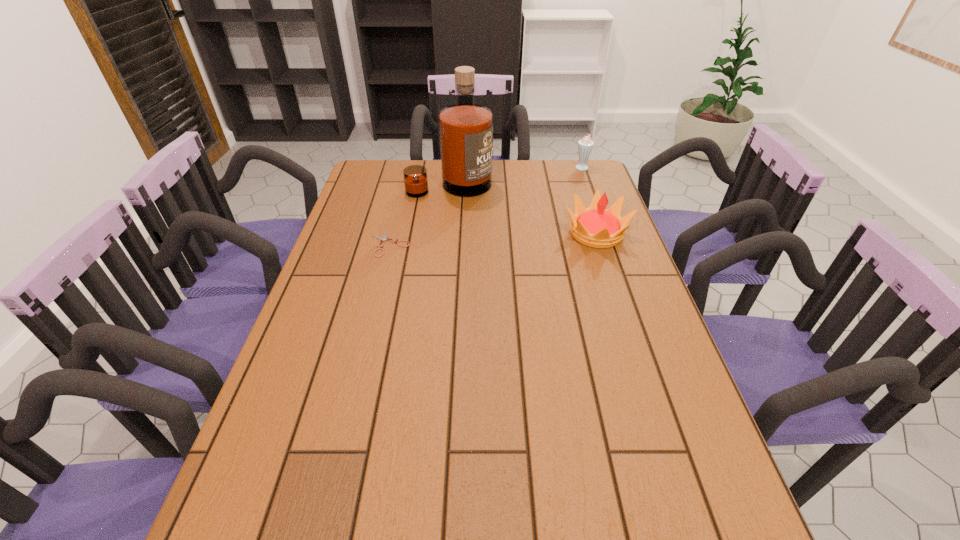
This screenshot has height=540, width=960. I want to click on unoccupied area between the milkshake and the liquor, so click(x=517, y=176).

Locate an element on the screen. The width and height of the screenshot is (960, 540). vacant space in between the shears and the liquor is located at coordinates (420, 214).

The width and height of the screenshot is (960, 540). I want to click on free area in between the milkshake and the shears, so click(488, 206).

I want to click on free space between the farthest object and the crown, so click(590, 200).

What are the coordinates of `blank region between the crown and the milkshake` in the screenshot? It's located at (590, 200).

Locate which object is the third closest to the crown. Please provide its 2D coordinates. Your answer should be formatted as a tuple, i.e. [(x, y)], where the tuple contains the x and y coordinates of a point satisfying the conditions above.

[(384, 238)]

Identify which object is the closest to the crown. Please provide its 2D coordinates. Your answer should be formatted as a tuple, i.e. [(x, y)], where the tuple contains the x and y coordinates of a point satisfying the conditions above.

[(465, 129)]

What are the coordinates of `free space that satisfies the following two spatial constraints: 1. on the back side of the crown; 2. on the right side of the farthest object` in the screenshot? It's located at (575, 167).

The image size is (960, 540). Find the location of `vacant space that satisfies the following two spatial constraints: 1. on the back side of the farthest object; 2. on the left side of the shortest object`. vacant space that satisfies the following two spatial constraints: 1. on the back side of the farthest object; 2. on the left side of the shortest object is located at coordinates (409, 167).

Identify the location of vacant position in the image that satisfies the following two spatial constraints: 1. on the back side of the shortest object; 2. on the right side of the crown. The height and width of the screenshot is (540, 960). (393, 233).